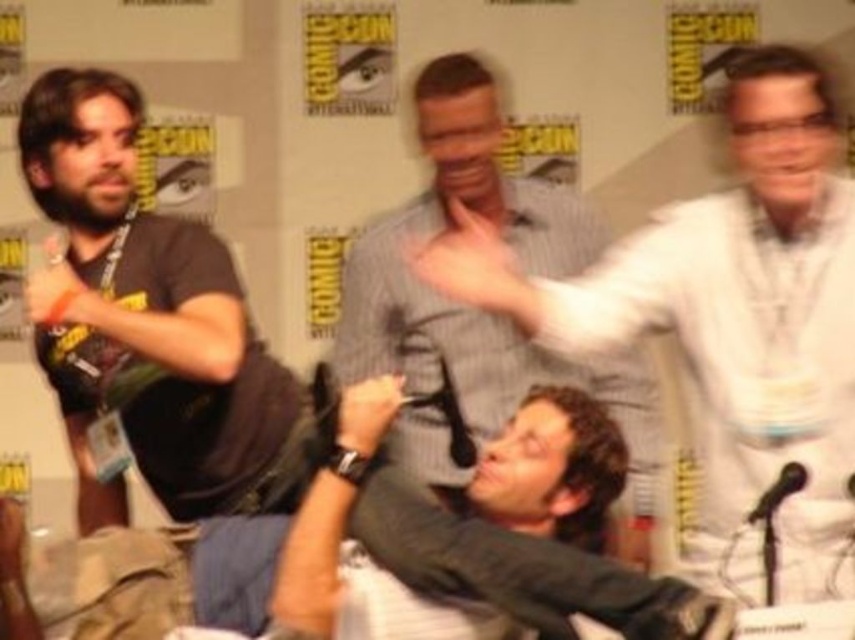
Question: Which of the following is the farthest from the observer?

Choices:
 (A) gray fabric shirt at lower center
 (B) matte black t-shirt at left
 (C) white shirt at upper right

Answer: (B)

Question: Observing the image, what is the correct spatial positioning of matte black t-shirt at left in reference to gray striped shirt at center?

Choices:
 (A) above
 (B) below

Answer: (A)

Question: Can you confirm if matte black t-shirt at left is bigger than gray striped shirt at center?

Choices:
 (A) yes
 (B) no

Answer: (B)

Question: Does white shirt at upper right appear on the right side of gray striped shirt at center?

Choices:
 (A) no
 (B) yes

Answer: (B)

Question: Considering the real-world distances, which object is closest to the gray fabric shirt at lower center?

Choices:
 (A) gray striped shirt at center
 (B) white shirt at upper right

Answer: (B)

Question: Which object appears farthest from the camera in this image?

Choices:
 (A) matte black t-shirt at left
 (B) gray striped shirt at center
 (C) white shirt at upper right
 (D) gray fabric shirt at lower center

Answer: (B)